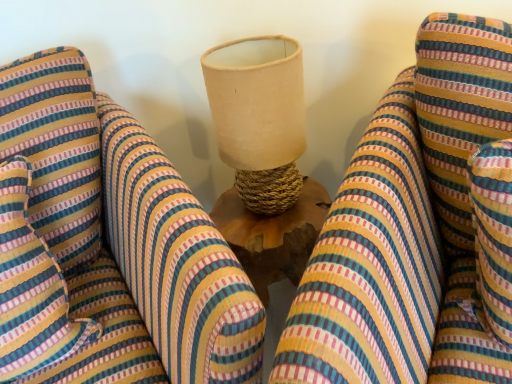
I want to click on striped fabric bean bag chair at center, which ranks as the 2th bean bag chair in left-to-right order, so click(419, 228).

Which of these two, striped fabric bean bag chair at center, which is the 1th bean bag chair from right to left, or striped fabric pillow at left, stands taller?

With more height is striped fabric bean bag chair at center, which is the 1th bean bag chair from right to left.

Is striped fabric bean bag chair at center, which is the 1th bean bag chair from right to left, located outside striped fabric pillow at left?

Yes, striped fabric bean bag chair at center, which is the 1th bean bag chair from right to left, is located beyond the bounds of striped fabric pillow at left.

Measure the distance from striped fabric bean bag chair at center, marked as the 1th bean bag chair in a left-to-right arrangement, to beige fabric lampshade at center.

striped fabric bean bag chair at center, marked as the 1th bean bag chair in a left-to-right arrangement, and beige fabric lampshade at center are 28.49 centimeters apart from each other.

Does striped fabric bean bag chair at center, the 2th bean bag chair viewed from the right, have a smaller size compared to beige fabric lampshade at center?

No.

From a real-world perspective, which is physically above, striped fabric bean bag chair at center, marked as the 1th bean bag chair in a left-to-right arrangement, or beige fabric lampshade at center?

beige fabric lampshade at center is physically above.

Where is `table lamp above the striped fabric bean bag chair at center, the 2th bean bag chair viewed from the right (from the image's perspective)`? The image size is (512, 384). table lamp above the striped fabric bean bag chair at center, the 2th bean bag chair viewed from the right (from the image's perspective) is located at coordinates (259, 117).

From the image's perspective, is striped fabric pillow at left on top of striped fabric bean bag chair at center, the 2th bean bag chair viewed from the right?

Yes, from the image's perspective, striped fabric pillow at left is above striped fabric bean bag chair at center, the 2th bean bag chair viewed from the right.

Which is less distant, (x=19, y=336) or (x=31, y=196)?

Clearly, point (x=19, y=336) is closer to the camera than point (x=31, y=196).

Image resolution: width=512 pixels, height=384 pixels. I want to click on pillow lying above the striped fabric bean bag chair at center, marked as the 1th bean bag chair in a left-to-right arrangement (from the image's perspective), so click(31, 288).

From the image's perspective, who appears lower, striped fabric bean bag chair at center, which ranks as the 2th bean bag chair in left-to-right order, or striped fabric bean bag chair at center, the 2th bean bag chair viewed from the right?

striped fabric bean bag chair at center, the 2th bean bag chair viewed from the right.

Is striped fabric bean bag chair at center, which ranks as the 2th bean bag chair in left-to-right order, not close to striped fabric bean bag chair at center, marked as the 1th bean bag chair in a left-to-right arrangement?

They are positioned close to each other.

Considering the relative sizes of striped fabric bean bag chair at center, which is the 1th bean bag chair from right to left, and striped fabric bean bag chair at center, marked as the 1th bean bag chair in a left-to-right arrangement, in the image provided, is striped fabric bean bag chair at center, which is the 1th bean bag chair from right to left, bigger than striped fabric bean bag chair at center, marked as the 1th bean bag chair in a left-to-right arrangement,?

Actually, striped fabric bean bag chair at center, which is the 1th bean bag chair from right to left, might be smaller than striped fabric bean bag chair at center, marked as the 1th bean bag chair in a left-to-right arrangement.

Is striped fabric bean bag chair at center, which ranks as the 2th bean bag chair in left-to-right order, thinner than striped fabric bean bag chair at center, marked as the 1th bean bag chair in a left-to-right arrangement?

Indeed, striped fabric bean bag chair at center, which ranks as the 2th bean bag chair in left-to-right order, has a lesser width compared to striped fabric bean bag chair at center, marked as the 1th bean bag chair in a left-to-right arrangement.

Is beige fabric lampshade at center beside striped fabric bean bag chair at center, marked as the 1th bean bag chair in a left-to-right arrangement?

beige fabric lampshade at center and striped fabric bean bag chair at center, marked as the 1th bean bag chair in a left-to-right arrangement, are not in contact.

Considering the relative sizes of beige fabric lampshade at center and striped fabric bean bag chair at center, marked as the 1th bean bag chair in a left-to-right arrangement, in the image provided, is beige fabric lampshade at center shorter than striped fabric bean bag chair at center, marked as the 1th bean bag chair in a left-to-right arrangement,?

Yes, beige fabric lampshade at center is shorter than striped fabric bean bag chair at center, marked as the 1th bean bag chair in a left-to-right arrangement.

Does point (242, 48) come closer to viewer compared to point (32, 73)?

No, it is not.

Is beige fabric lampshade at center at the right side of striped fabric bean bag chair at center, marked as the 1th bean bag chair in a left-to-right arrangement?

Indeed, beige fabric lampshade at center is positioned on the right side of striped fabric bean bag chair at center, marked as the 1th bean bag chair in a left-to-right arrangement.

Considering the sizes of objects striped fabric pillow at left and beige fabric lampshade at center in the image provided, who is wider, striped fabric pillow at left or beige fabric lampshade at center?

With larger width is striped fabric pillow at left.

Does striped fabric pillow at left have a greater height compared to beige fabric lampshade at center?

Yes.

From the image's perspective, between striped fabric pillow at left and beige fabric lampshade at center, who is located below?

From the image's view, striped fabric pillow at left is below.

How far apart are striped fabric pillow at left and beige fabric lampshade at center?

striped fabric pillow at left is 43.22 centimeters away from beige fabric lampshade at center.

Considering the sizes of striped fabric bean bag chair at center, marked as the 1th bean bag chair in a left-to-right arrangement, and striped fabric pillow at left in the image, is striped fabric bean bag chair at center, marked as the 1th bean bag chair in a left-to-right arrangement, taller or shorter than striped fabric pillow at left?

In the image, striped fabric bean bag chair at center, marked as the 1th bean bag chair in a left-to-right arrangement, appears to be taller than striped fabric pillow at left.

Would you say striped fabric bean bag chair at center, marked as the 1th bean bag chair in a left-to-right arrangement, is outside striped fabric pillow at left?

Yes, striped fabric bean bag chair at center, marked as the 1th bean bag chair in a left-to-right arrangement, is outside of striped fabric pillow at left.

Could you tell me if striped fabric bean bag chair at center, the 2th bean bag chair viewed from the right, is turned towards striped fabric pillow at left?

Yes, striped fabric bean bag chair at center, the 2th bean bag chair viewed from the right, faces towards striped fabric pillow at left.

From the image's perspective, is striped fabric bean bag chair at center, marked as the 1th bean bag chair in a left-to-right arrangement, beneath striped fabric pillow at left?

Yes, from the image's perspective, striped fabric bean bag chair at center, marked as the 1th bean bag chair in a left-to-right arrangement, is below striped fabric pillow at left.

Find the location of a particular element. pillow above the striped fabric bean bag chair at center, which ranks as the 2th bean bag chair in left-to-right order (from a real-world perspective) is located at coordinates (31, 288).

Locate an element on the screen. table lamp above the striped fabric bean bag chair at center, the 2th bean bag chair viewed from the right (from the image's perspective) is located at coordinates (259, 117).

When comparing their distances from beige fabric lampshade at center, does striped fabric bean bag chair at center, which ranks as the 2th bean bag chair in left-to-right order, or striped fabric bean bag chair at center, the 2th bean bag chair viewed from the right, seem closer?

Among the two, striped fabric bean bag chair at center, the 2th bean bag chair viewed from the right, is located nearer to beige fabric lampshade at center.

From the picture: From the image, which object appears to be farther from beige fabric lampshade at center, striped fabric pillow at left or striped fabric bean bag chair at center, which is the 1th bean bag chair from right to left?

Based on the image, striped fabric pillow at left appears to be further to beige fabric lampshade at center.

Looking at the image, which one is located closer to striped fabric bean bag chair at center, which is the 1th bean bag chair from right to left, striped fabric pillow at left or striped fabric bean bag chair at center, the 2th bean bag chair viewed from the right?

Among the two, striped fabric bean bag chair at center, the 2th bean bag chair viewed from the right, is located nearer to striped fabric bean bag chair at center, which is the 1th bean bag chair from right to left.

Which object lies further to the anchor point beige fabric lampshade at center, striped fabric pillow at left or striped fabric bean bag chair at center, marked as the 1th bean bag chair in a left-to-right arrangement?

Among the two, striped fabric pillow at left is located further to beige fabric lampshade at center.

When comparing their distances from striped fabric pillow at left, does striped fabric bean bag chair at center, the 2th bean bag chair viewed from the right, or striped fabric bean bag chair at center, which is the 1th bean bag chair from right to left, seem closer?

Based on the image, striped fabric bean bag chair at center, the 2th bean bag chair viewed from the right, appears to be nearer to striped fabric pillow at left.

Looking at the image, which one is located further to striped fabric bean bag chair at center, the 2th bean bag chair viewed from the right, striped fabric pillow at left or beige fabric lampshade at center?

Among the two, beige fabric lampshade at center is located further to striped fabric bean bag chair at center, the 2th bean bag chair viewed from the right.

When comparing their distances from striped fabric bean bag chair at center, which ranks as the 2th bean bag chair in left-to-right order, does striped fabric pillow at left or beige fabric lampshade at center seem closer?

beige fabric lampshade at center.

When comparing their distances from striped fabric bean bag chair at center, the 2th bean bag chair viewed from the right, does beige fabric lampshade at center or striped fabric bean bag chair at center, which is the 1th bean bag chair from right to left, seem closer?

beige fabric lampshade at center is positioned closer to the anchor striped fabric bean bag chair at center, the 2th bean bag chair viewed from the right.

Where is `table lamp located between striped fabric pillow at left and striped fabric bean bag chair at center, which is the 1th bean bag chair from right to left, in the left-right direction`? The image size is (512, 384). table lamp located between striped fabric pillow at left and striped fabric bean bag chair at center, which is the 1th bean bag chair from right to left, in the left-right direction is located at coordinates (259, 117).

The width and height of the screenshot is (512, 384). Find the location of `bean bag chair located between striped fabric pillow at left and striped fabric bean bag chair at center, which is the 1th bean bag chair from right to left, in the left-right direction`. bean bag chair located between striped fabric pillow at left and striped fabric bean bag chair at center, which is the 1th bean bag chair from right to left, in the left-right direction is located at coordinates (108, 245).

In order to click on pillow between striped fabric bean bag chair at center, marked as the 1th bean bag chair in a left-to-right arrangement, and beige fabric lampshade at center, along the z-axis in this screenshot , I will do `click(31, 288)`.

Find the location of a particular element. The image size is (512, 384). table lamp between striped fabric bean bag chair at center, the 2th bean bag chair viewed from the right, and striped fabric bean bag chair at center, which ranks as the 2th bean bag chair in left-to-right order, from left to right is located at coordinates (x=259, y=117).